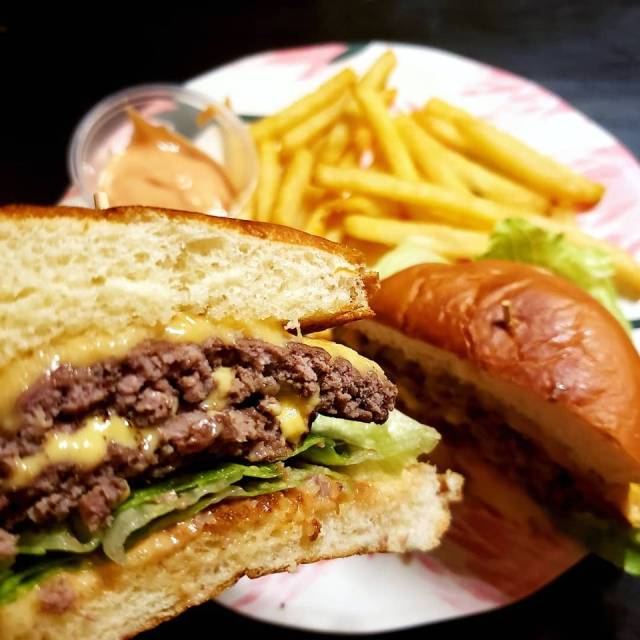
The height and width of the screenshot is (640, 640). In order to click on plate in this screenshot , I will do `click(495, 522)`.